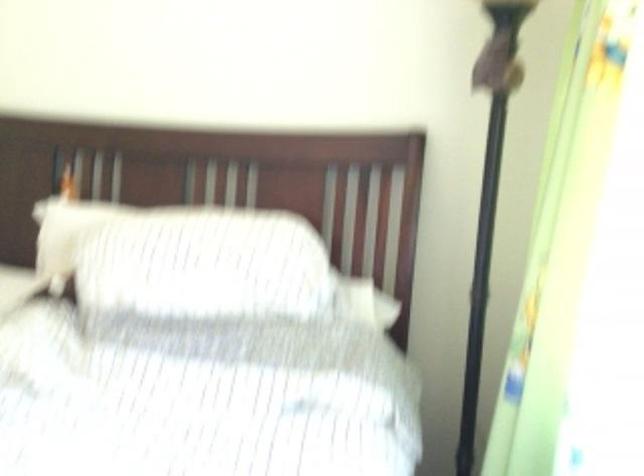
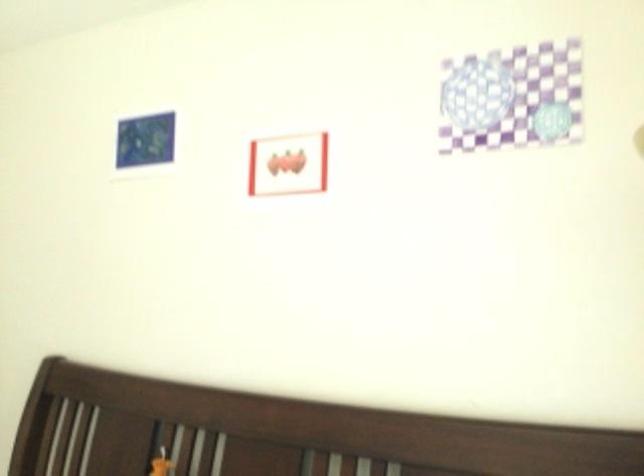
How did the camera likely rotate?

The camera's rotation is toward left-up.